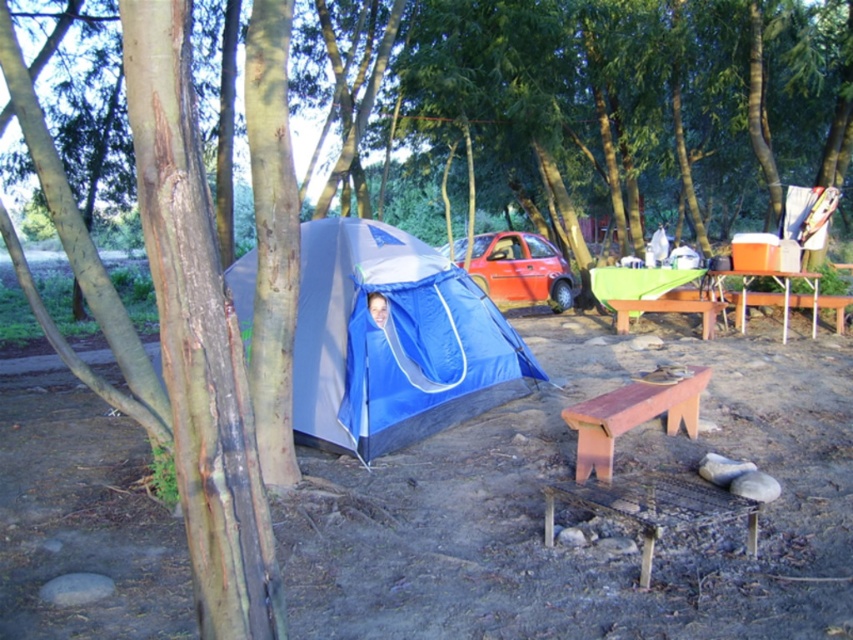
Question: Which point appears farthest from the camera in this image?

Choices:
 (A) (312, 385)
 (B) (566, 305)
 (C) (709, 298)

Answer: (B)

Question: From the image, what is the correct spatial relationship of brown wooden bench at lower center in relation to orange plastic picnic table at right?

Choices:
 (A) above
 (B) below

Answer: (B)

Question: Which point appears farthest from the camera in this image?

Choices:
 (A) (612, 390)
 (B) (306, 316)
 (C) (709, 288)

Answer: (C)

Question: Is matte red car at center in front of orange plastic picnic table at right?

Choices:
 (A) yes
 (B) no

Answer: (B)

Question: Can you confirm if blue tarpaulin tent at center is positioned to the left of orange plastic picnic table at right?

Choices:
 (A) no
 (B) yes

Answer: (B)

Question: Which point is farther from the camera taking this photo?

Choices:
 (A) (746, 292)
 (B) (611, 413)
 (C) (445, 256)
 (D) (306, 324)

Answer: (C)